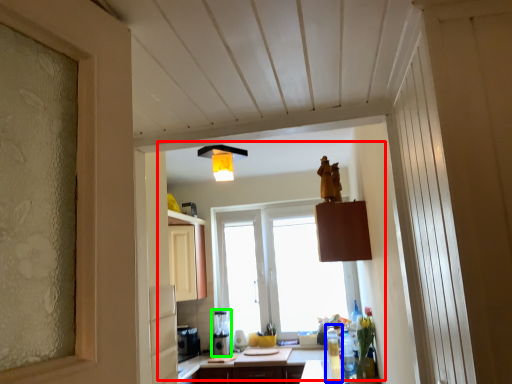
Question: Which object is the closest to the bay window (highlighted by a red box)? Choose among these: bottle (highlighted by a blue box) or coffee machine (highlighted by a green box).

Choices:
 (A) bottle
 (B) coffee machine

Answer: (B)